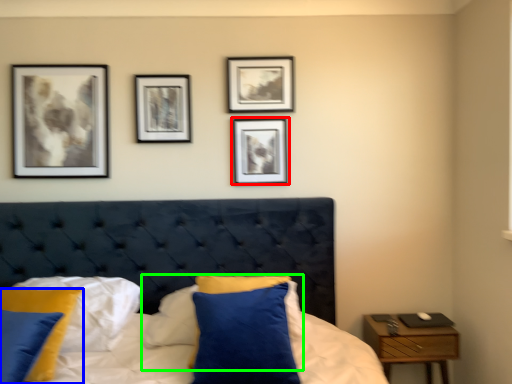
Question: Based on their relative distances, which object is nearer to picture frame (highlighted by a red box)? Choose from pillow (highlighted by a blue box) and pillow (highlighted by a green box).

Choices:
 (A) pillow
 (B) pillow

Answer: (B)